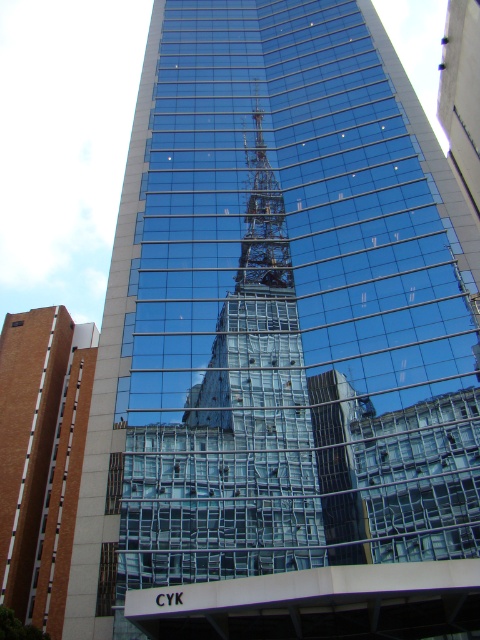
Question: Among these objects, which one is nearest to the camera?

Choices:
 (A) brown brick building at lower left
 (B) metallic lattice structure at center

Answer: (B)

Question: From the image, what is the correct spatial relationship of brown brick building at lower left in relation to metallic lattice structure at center?

Choices:
 (A) below
 (B) above

Answer: (A)

Question: Does brown brick building at lower left have a smaller size compared to metallic lattice structure at center?

Choices:
 (A) yes
 (B) no

Answer: (B)

Question: Among these points, which one is farthest from the camera?

Choices:
 (A) (57, 417)
 (B) (269, 257)

Answer: (A)

Question: Is brown brick building at lower left further to camera compared to metallic lattice structure at center?

Choices:
 (A) no
 (B) yes

Answer: (B)